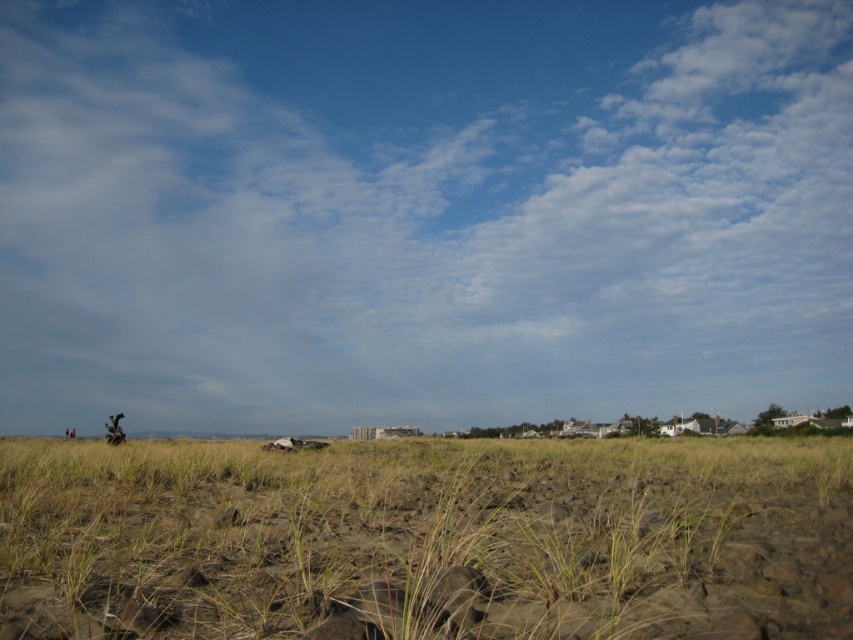
You are an astronaut on the moon looking down at this coastal landscape. You notice the white fluffy cloud at upper center and the brown sandy dirt field at center. Which object is closer to your viewpoint?

The white fluffy cloud at upper center is closer to your viewpoint because the brown sandy dirt field at center is behind it.

You are a hiker standing on the brown sandy dirt field at center and want to look up at the white fluffy cloud at upper center. How far apart are these two objects from your position?

The white fluffy cloud at upper center and brown sandy dirt field at center are 51.42 meters apart.

You are a photographer planning to take a picture of the white fluffy cloud at upper center from the beach. The camera you are using has a maximum focus range of 200 feet. Will the cloud be in focus?

The white fluffy cloud at upper center is 231.29 feet from the camera, which exceeds the maximum focus range of 200 feet. Therefore, the cloud will not be in focus.